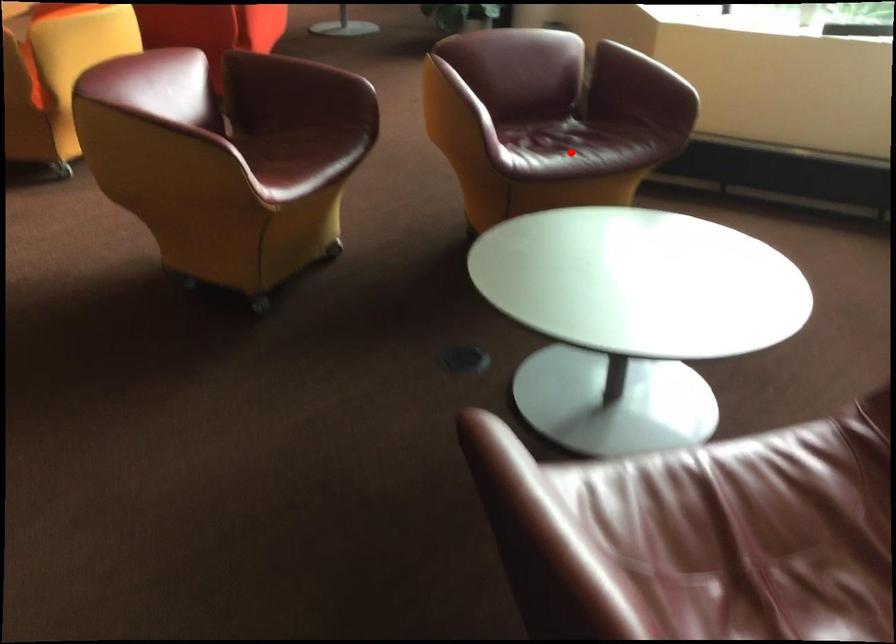
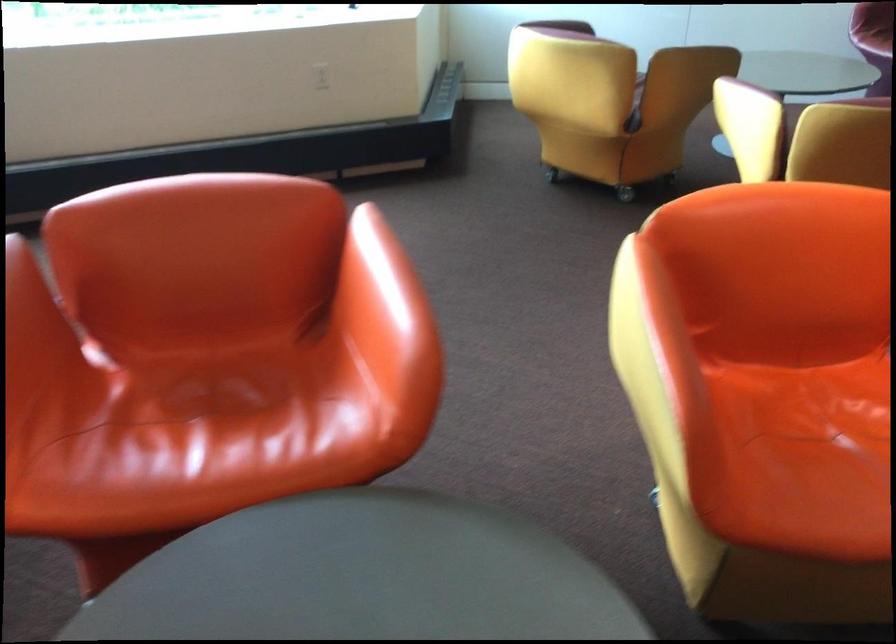
Question: I am providing you with two images of the same scene from different viewpoints. A red point is marked on the first image. Is the red point's position out of view in image 2?

Choices:
 (A) Yes
 (B) No

Answer: (A)